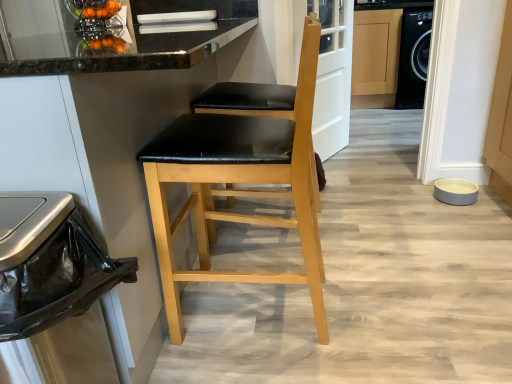
Image resolution: width=512 pixels, height=384 pixels. What do you see at coordinates (239, 182) in the screenshot?
I see `black leather chair at center, arranged as the first chair when viewed from the front` at bounding box center [239, 182].

Measure the distance between gray matte pet bowl at lower right, which is the first appliance in bottom-to-top order, and camera.

gray matte pet bowl at lower right, which is the first appliance in bottom-to-top order, is 7.01 feet from camera.

The width and height of the screenshot is (512, 384). In order to click on matte wood cabinet at center in this screenshot , I will do `click(375, 58)`.

Which is closer to the camera, (x=386, y=87) or (x=93, y=17)?

Point (x=386, y=87) appears to be farther away from the viewer than point (x=93, y=17).

How different are the orientations of matte wood cabinet at center and metallic silver fruit bowl at upper left, which is the first appliance from left to right, in degrees?

The angle between the facing direction of matte wood cabinet at center and the facing direction of metallic silver fruit bowl at upper left, which is the first appliance from left to right, is 2.61 degrees.

In the scene shown: From a real-world perspective, which is physically below, matte wood cabinet at center or metallic silver fruit bowl at upper left, which is the first appliance from left to right?

In real-world perspective, matte wood cabinet at center is lower.

Do you think matte wood cabinet at center is within metallic silver fruit bowl at upper left, which is the second appliance in right-to-left order, or outside of it?

matte wood cabinet at center is spatially situated outside metallic silver fruit bowl at upper left, which is the second appliance in right-to-left order.

In the scene shown: Is gray matte pet bowl at lower right, the second appliance positioned from the left, smaller than metallic silver fruit bowl at upper left, which is the first appliance from left to right?

Incorrect, gray matte pet bowl at lower right, the second appliance positioned from the left, is not smaller in size than metallic silver fruit bowl at upper left, which is the first appliance from left to right.

Between gray matte pet bowl at lower right, arranged as the 2th appliance when viewed from the top, and metallic silver fruit bowl at upper left, which is the second appliance in right-to-left order, which one appears on the right side from the viewer's perspective?

From the viewer's perspective, gray matte pet bowl at lower right, arranged as the 2th appliance when viewed from the top, appears more on the right side.

Where is `appliance that appears on the left of gray matte pet bowl at lower right, arranged as the 2th appliance when viewed from the top`? The height and width of the screenshot is (384, 512). appliance that appears on the left of gray matte pet bowl at lower right, arranged as the 2th appliance when viewed from the top is located at coordinates (95, 15).

From a real-world perspective, is gray matte pet bowl at lower right, arranged as the 2th appliance when viewed from the top, located higher than metallic silver fruit bowl at upper left, which is the second appliance in right-to-left order?

Incorrect, from a real-world perspective, gray matte pet bowl at lower right, arranged as the 2th appliance when viewed from the top, is lower than metallic silver fruit bowl at upper left, which is the second appliance in right-to-left order.

Looking at this image, from a real-world perspective, who is located higher, metallic silver fruit bowl at upper left, the second appliance positioned from the bottom, or metallic trash can at left?

In real-world perspective, metallic silver fruit bowl at upper left, the second appliance positioned from the bottom, is above.

From the picture: Between metallic silver fruit bowl at upper left, the second appliance positioned from the bottom, and metallic trash can at left, which one has larger size?

Bigger between the two is metallic trash can at left.

How distant is metallic silver fruit bowl at upper left, which is the first appliance from left to right, from metallic trash can at left?

The distance of metallic silver fruit bowl at upper left, which is the first appliance from left to right, from metallic trash can at left is 4.80 feet.

Considering the positions of objects metallic silver fruit bowl at upper left, which is the second appliance in right-to-left order, and metallic trash can at left in the image provided, who is more to the right, metallic silver fruit bowl at upper left, which is the second appliance in right-to-left order, or metallic trash can at left?

metallic trash can at left.

Between point (1, 329) and point (475, 188), which one is positioned behind?

The point (475, 188) is more distant.

Based on the photo, considering the relative sizes of metallic trash can at left and gray matte pet bowl at lower right, arranged as the first appliance when viewed from the right, in the image provided, is metallic trash can at left wider than gray matte pet bowl at lower right, arranged as the first appliance when viewed from the right,?

Indeed, metallic trash can at left has a greater width compared to gray matte pet bowl at lower right, arranged as the first appliance when viewed from the right.

Can you tell me how much metallic trash can at left and gray matte pet bowl at lower right, which is the first appliance in bottom-to-top order, differ in facing direction?

metallic trash can at left and gray matte pet bowl at lower right, which is the first appliance in bottom-to-top order, are facing 96.1 degrees away from each other.

Which object is closer to the camera taking this photo, metallic trash can at left or gray matte pet bowl at lower right, arranged as the 2th appliance when viewed from the top?

metallic trash can at left.

Considering the relative sizes of black leather chair at center, positioned as the second chair in back-to-front order, and matte black seat at center, which is counted as the 2th chair, starting from the front, in the image provided, is black leather chair at center, positioned as the second chair in back-to-front order, taller than matte black seat at center, which is counted as the 2th chair, starting from the front,?

Yes, black leather chair at center, positioned as the second chair in back-to-front order, is taller than matte black seat at center, which is counted as the 2th chair, starting from the front.

Is black leather chair at center, positioned as the second chair in back-to-front order, placed right next to matte black seat at center, which is counted as the 2th chair, starting from the front?

They are not placed beside each other.

Is point (277, 181) positioned behind point (293, 106)?

No, it is in front of (293, 106).

Does black leather chair at center, arranged as the first chair when viewed from the front, have a lesser width compared to matte black seat at center, which is counted as the 2th chair, starting from the front?

Correct, the width of black leather chair at center, arranged as the first chair when viewed from the front, is less than that of matte black seat at center, which is counted as the 2th chair, starting from the front.

From a real-world perspective, is metallic silver fruit bowl at upper left, the first appliance when ordered from top to bottom, physically above black leather chair at center, arranged as the first chair when viewed from the front?

Indeed, from a real-world perspective, metallic silver fruit bowl at upper left, the first appliance when ordered from top to bottom, stands above black leather chair at center, arranged as the first chair when viewed from the front.

Does point (99, 15) lie in front of point (152, 143)?

No, (99, 15) is further to viewer.

Which of these two, metallic silver fruit bowl at upper left, which is the first appliance from left to right, or black leather chair at center, arranged as the first chair when viewed from the front, is bigger?

black leather chair at center, arranged as the first chair when viewed from the front, is bigger.

Is metallic silver fruit bowl at upper left, the second appliance positioned from the bottom, oriented away from black leather chair at center, arranged as the first chair when viewed from the front?

No, black leather chair at center, arranged as the first chair when viewed from the front, is not at the back of metallic silver fruit bowl at upper left, the second appliance positioned from the bottom.

Which is in front, metallic trash can at left or black leather chair at center, positioned as the second chair in back-to-front order?

metallic trash can at left.

Is metallic trash can at left far away from black leather chair at center, positioned as the second chair in back-to-front order?

That's not correct — metallic trash can at left is a little close to black leather chair at center, positioned as the second chair in back-to-front order.

Between metallic trash can at left and black leather chair at center, positioned as the second chair in back-to-front order, which one appears on the left side from the viewer's perspective?

metallic trash can at left.

This screenshot has width=512, height=384. In the image, there is a metallic silver fruit bowl at upper left, which is the second appliance in right-to-left order. Find the location of `cabinetry below it (from a real-world perspective)`. cabinetry below it (from a real-world perspective) is located at coordinates (375, 58).

The height and width of the screenshot is (384, 512). In order to click on appliance to the right of metallic silver fruit bowl at upper left, the second appliance positioned from the bottom in this screenshot , I will do `click(455, 191)`.

Looking at the image, which one is located further to gray matte pet bowl at lower right, arranged as the 2th appliance when viewed from the top, matte wood cabinet at center or matte black seat at center, which is counted as the 2th chair, starting from the front?

Among the two, matte wood cabinet at center is located further to gray matte pet bowl at lower right, arranged as the 2th appliance when viewed from the top.

Looking at the image, which one is located closer to matte black seat at center, which is counted as the 2th chair, starting from the front, metallic trash can at left or black leather chair at center, positioned as the second chair in back-to-front order?

black leather chair at center, positioned as the second chair in back-to-front order, is positioned closer to the anchor matte black seat at center, which is counted as the 2th chair, starting from the front.

Consider the image. Based on their spatial positions, is matte black seat at center, the 1th chair from the back, or black leather chair at center, positioned as the second chair in back-to-front order, further from matte wood cabinet at center?

black leather chair at center, positioned as the second chair in back-to-front order.

Looking at the image, which one is located further to metallic trash can at left, matte wood cabinet at center or gray matte pet bowl at lower right, which is the first appliance in bottom-to-top order?

The object further to metallic trash can at left is matte wood cabinet at center.

From the image, which object appears to be farther from black leather chair at center, arranged as the first chair when viewed from the front, metallic silver fruit bowl at upper left, which is the second appliance in right-to-left order, or metallic trash can at left?

metallic silver fruit bowl at upper left, which is the second appliance in right-to-left order, is further to black leather chair at center, arranged as the first chair when viewed from the front.

Estimate the real-world distances between objects in this image. Which object is further from matte black seat at center, which is counted as the 2th chair, starting from the front, metallic trash can at left or matte wood cabinet at center?

matte wood cabinet at center lies further to matte black seat at center, which is counted as the 2th chair, starting from the front, than the other object.

Considering their positions, is black leather chair at center, positioned as the second chair in back-to-front order, positioned closer to metallic trash can at left than matte black seat at center, the 1th chair from the back?

black leather chair at center, positioned as the second chair in back-to-front order, is closer to metallic trash can at left.

When comparing their distances from gray matte pet bowl at lower right, arranged as the first appliance when viewed from the right, does matte wood cabinet at center or metallic trash can at left seem further?

Among the two, matte wood cabinet at center is located further to gray matte pet bowl at lower right, arranged as the first appliance when viewed from the right.

Locate an element on the screen. This screenshot has height=384, width=512. home appliance between metallic silver fruit bowl at upper left, the second appliance positioned from the bottom, and gray matte pet bowl at lower right, the second appliance positioned from the left is located at coordinates (49, 272).

Locate an element on the screen. Image resolution: width=512 pixels, height=384 pixels. appliance situated between metallic silver fruit bowl at upper left, the second appliance positioned from the bottom, and matte wood cabinet at center from left to right is located at coordinates (455, 191).

You are a GUI agent. You are given a task and a screenshot of the screen. Output one action in this format:
    pyautogui.click(x=<x>, y=<y>)
    Task: Click on the chair between black leather chair at center, arranged as the first chair when viewed from the front, and gray matte pet bowl at lower right, which is the first appliance in bottom-to-top order, in the horizontal direction
    
    Given the screenshot: What is the action you would take?
    point(247,100)

The width and height of the screenshot is (512, 384). In order to click on chair between black leather chair at center, arranged as the first chair when viewed from the front, and metallic silver fruit bowl at upper left, the first appliance when ordered from top to bottom, in the front-back direction in this screenshot , I will do pyautogui.click(x=247, y=100).